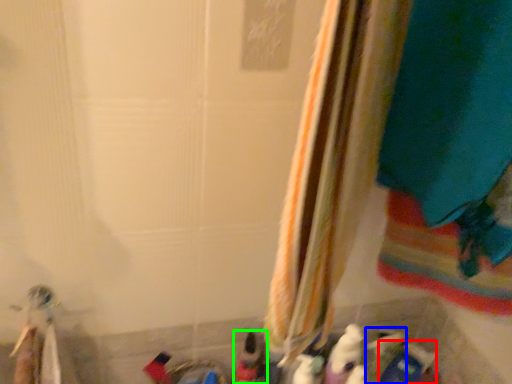
Question: Which object is the farthest from toy (highlighted by a red box)? Choose among these: toy (highlighted by a blue box) or toy (highlighted by a green box).

Choices:
 (A) toy
 (B) toy

Answer: (B)